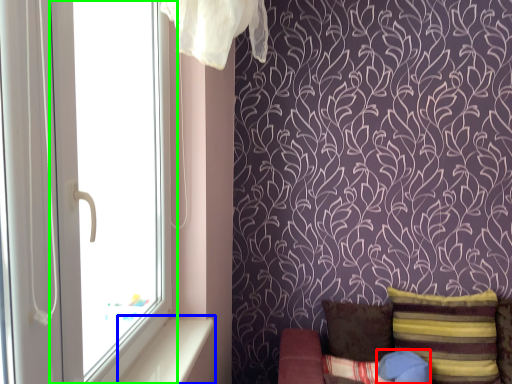
Question: Considering the real-world distances, which object is closest to pillow (highlighted by a red box)? window sill (highlighted by a blue box) or window (highlighted by a green box).

Choices:
 (A) window sill
 (B) window

Answer: (A)